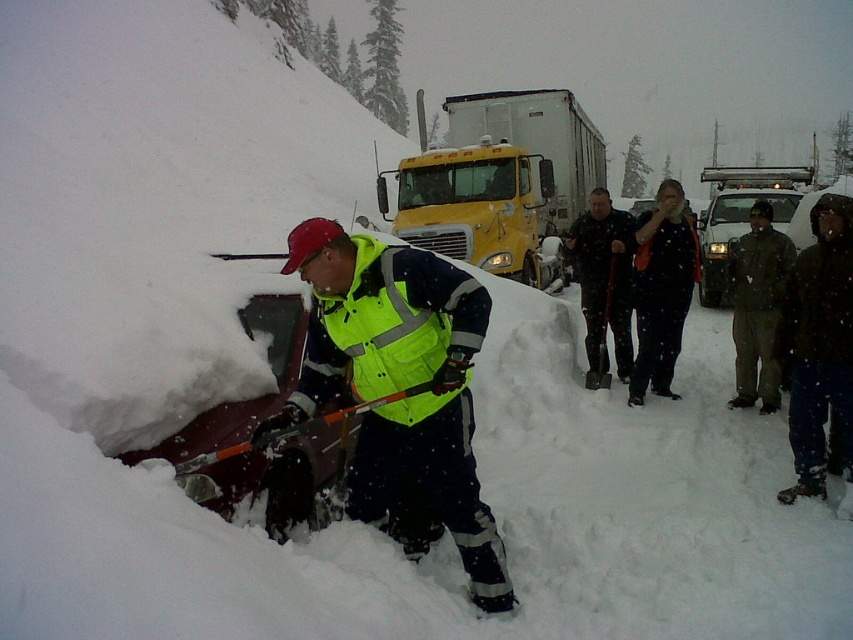
You are standing in the snowy scene and want to place a small flag at the closest point between point (358, 348) and point (763, 358). Which point should you choose?

Point (358, 348) is closer to the viewer than point (763, 358), so you should place the flag at point (358, 348).